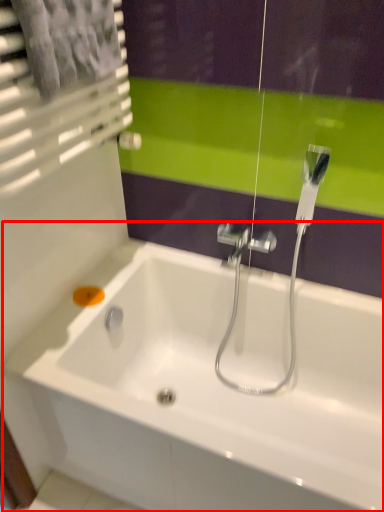
Question: Where is bathtub (annotated by the red box) located in relation to soap in the image?

Choices:
 (A) left
 (B) right

Answer: (B)